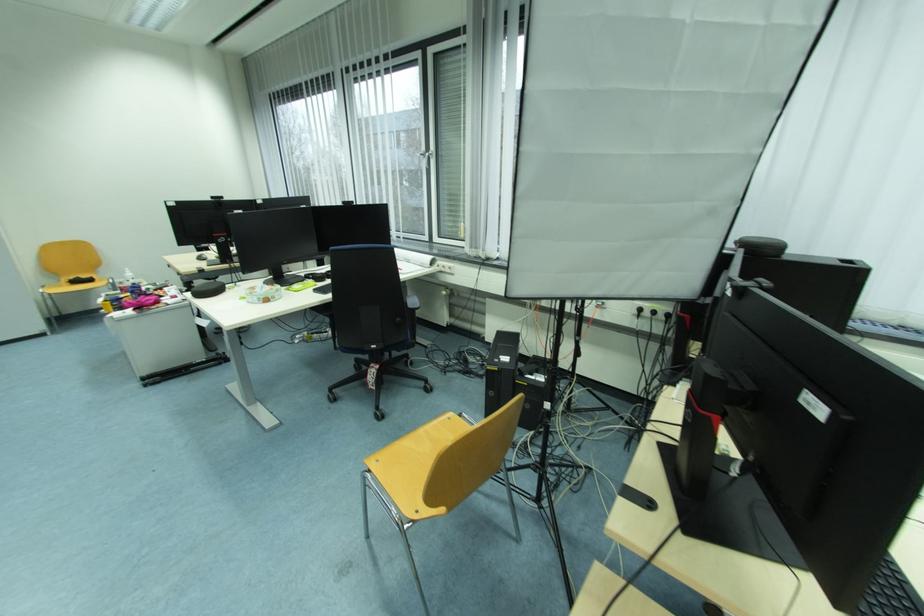
This screenshot has width=924, height=616. What do you see at coordinates (427, 156) in the screenshot?
I see `the white window handle` at bounding box center [427, 156].